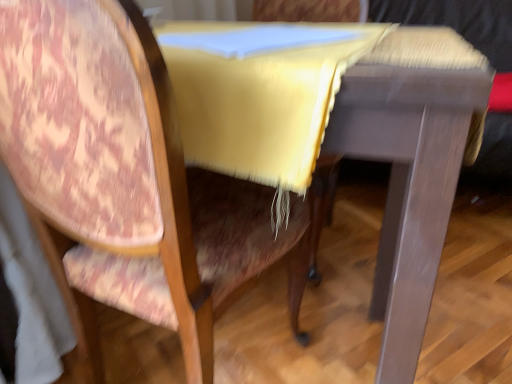
Find the location of `wooden table at center`. wooden table at center is located at coordinates (410, 167).

Describe the element at coordinates (410, 167) in the screenshot. I see `wooden table at center` at that location.

The width and height of the screenshot is (512, 384). What do you see at coordinates (160, 223) in the screenshot?
I see `velvet-like pink chair at left` at bounding box center [160, 223].

Locate an element on the screen. velvet-like pink chair at left is located at coordinates (160, 223).

What is the approximate width of velvet-like pink chair at left?

velvet-like pink chair at left is 51.78 centimeters in width.

Find the location of a particular element. This screenshot has height=384, width=512. wooden table at center is located at coordinates (410, 167).

Is velvet-like pink chair at left to the left of wooden table at center from the viewer's perspective?

Indeed, velvet-like pink chair at left is positioned on the left side of wooden table at center.

Between velvet-like pink chair at left and wooden table at center, which one is positioned in front?

velvet-like pink chair at left is closer to the camera.

Is point (192, 323) closer or farther from the camera than point (372, 123)?

Clearly, point (192, 323) is more distant from the camera than point (372, 123).

From the image's perspective, between velvet-like pink chair at left and wooden table at center, which one is located above?

From the image's view, wooden table at center is above.

From a real-world perspective, which is physically below, velvet-like pink chair at left or wooden table at center?

wooden table at center is physically lower.

Considering the relative sizes of velvet-like pink chair at left and wooden table at center in the image provided, is velvet-like pink chair at left wider than wooden table at center?

No, velvet-like pink chair at left is not wider than wooden table at center.

Between velvet-like pink chair at left and wooden table at center, which one has more height?

Standing taller between the two is velvet-like pink chair at left.

Which of these two, velvet-like pink chair at left or wooden table at center, is smaller?

velvet-like pink chair at left is smaller.

Is wooden table at center a part of velvet-like pink chair at left?

Yes, wooden table at center is a part of velvet-like pink chair at left.

Are velvet-like pink chair at left and wooden table at center beside each other?

No, velvet-like pink chair at left is not in contact with wooden table at center.

Is velvet-like pink chair at left aimed at wooden table at center?

Yes, velvet-like pink chair at left is facing wooden table at center.

How many degrees apart are the facing directions of velvet-like pink chair at left and wooden table at center?

The facing directions of velvet-like pink chair at left and wooden table at center are 76.6 degrees apart.

The width and height of the screenshot is (512, 384). Identify the location of table above the velvet-like pink chair at left (from the image's perspective). (410, 167).

Does wooden table at center appear on the right side of velvet-like pink chair at left?

Yes, wooden table at center is to the right of velvet-like pink chair at left.

Is wooden table at center in front of or behind velvet-like pink chair at left in the image?

Clearly, wooden table at center is behind velvet-like pink chair at left.

Which point is more distant from viewer, (390, 101) or (133, 266)?

Point (133, 266)

From the image's perspective, is wooden table at center located beneath velvet-like pink chair at left?

No.

From a real-world perspective, does wooden table at center sit lower than velvet-like pink chair at left?

Yes, from a real-world perspective, wooden table at center is beneath velvet-like pink chair at left.

Is wooden table at center wider or thinner than velvet-like pink chair at left?

Clearly, wooden table at center has more width compared to velvet-like pink chair at left.

Considering the relative sizes of wooden table at center and velvet-like pink chair at left in the image provided, is wooden table at center taller than velvet-like pink chair at left?

In fact, wooden table at center may be shorter than velvet-like pink chair at left.

Who is smaller, wooden table at center or velvet-like pink chair at left?

velvet-like pink chair at left.

Can we say wooden table at center lies outside velvet-like pink chair at left?

That's incorrect, wooden table at center is not completely outside velvet-like pink chair at left.

Is wooden table at center with velvet-like pink chair at left?

No, wooden table at center is not in contact with velvet-like pink chair at left.

Is wooden table at center oriented towards velvet-like pink chair at left?

Yes, wooden table at center is turned towards velvet-like pink chair at left.

I want to click on table behind the velvet-like pink chair at left, so click(410, 167).

The image size is (512, 384). I want to click on chair above the wooden table at center (from a real-world perspective), so click(160, 223).

Where is `chair in front of the wooden table at center`? chair in front of the wooden table at center is located at coordinates (160, 223).